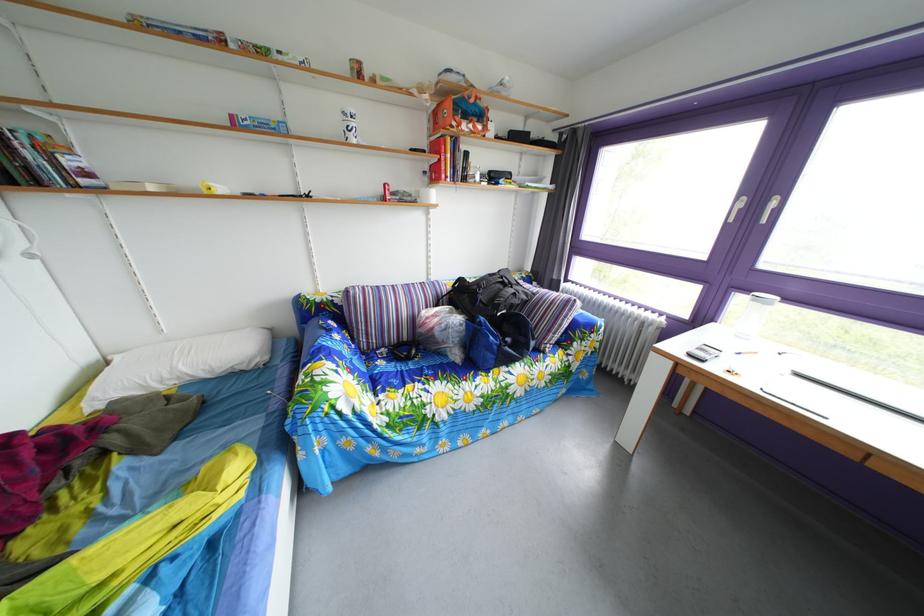
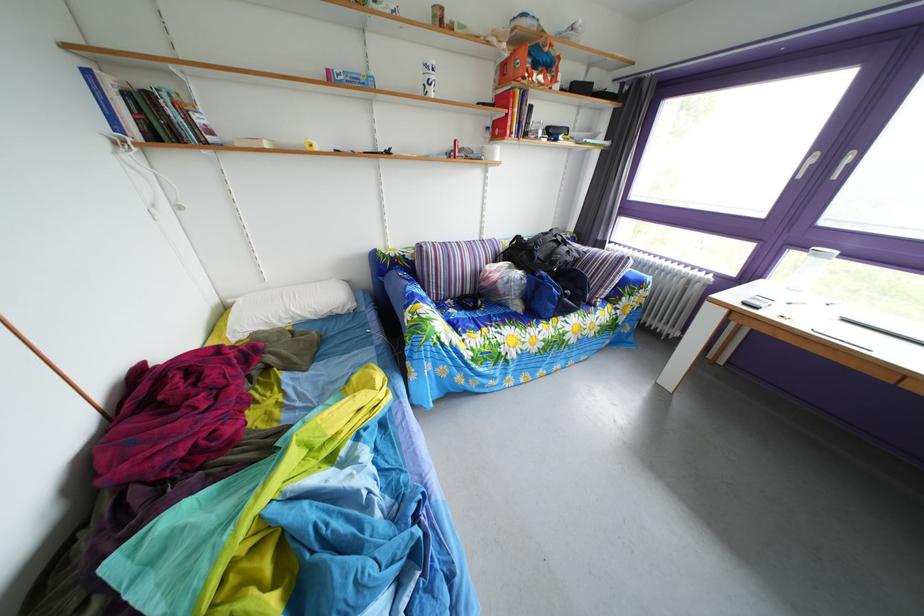
Locate, in the second image, the point that corresponds to point (472, 302) in the first image.

(529, 261)